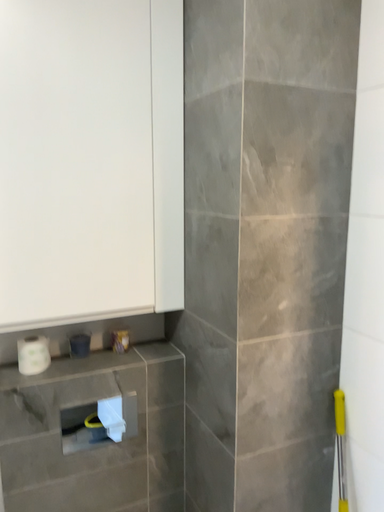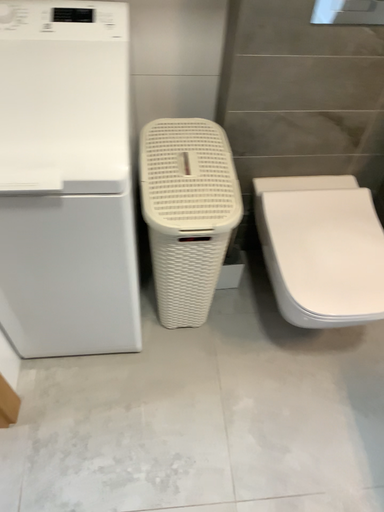
Question: How did the camera likely rotate when shooting the video?

Choices:
 (A) rotated upward
 (B) rotated downward

Answer: (B)